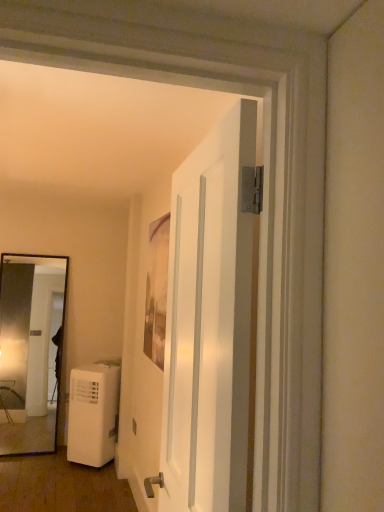
Question: Considering the relative sizes of white plastic air conditioner at lower left and white matte door at center in the image provided, is white plastic air conditioner at lower left shorter than white matte door at center?

Choices:
 (A) yes
 (B) no

Answer: (A)

Question: Is white plastic air conditioner at lower left behind white matte door at center?

Choices:
 (A) no
 (B) yes

Answer: (B)

Question: From the image's perspective, is white plastic air conditioner at lower left located beneath white matte door at center?

Choices:
 (A) no
 (B) yes

Answer: (B)

Question: Does white plastic air conditioner at lower left have a larger size compared to white matte door at center?

Choices:
 (A) no
 (B) yes

Answer: (B)

Question: Is white matte door at center completely or partially inside white plastic air conditioner at lower left?

Choices:
 (A) no
 (B) yes

Answer: (A)

Question: Considering the positions of white plastic air conditioner at lower left and white matte air purifier at lower left in the image, is white plastic air conditioner at lower left wider or thinner than white matte air purifier at lower left?

Choices:
 (A) wide
 (B) thin

Answer: (B)

Question: Based on their positions, is white plastic air conditioner at lower left located to the left or right of white matte air purifier at lower left?

Choices:
 (A) left
 (B) right

Answer: (B)

Question: In terms of height, does white plastic air conditioner at lower left look taller or shorter compared to white matte air purifier at lower left?

Choices:
 (A) short
 (B) tall

Answer: (B)

Question: From the image's perspective, is white plastic air conditioner at lower left above or below white matte air purifier at lower left?

Choices:
 (A) above
 (B) below

Answer: (A)

Question: From a real-world perspective, is white matte door at center above or below white plastic air conditioner at lower left?

Choices:
 (A) above
 (B) below

Answer: (A)

Question: Is white matte door at center in front of or behind white plastic air conditioner at lower left in the image?

Choices:
 (A) front
 (B) behind

Answer: (A)

Question: Is white matte door at center taller or shorter than white plastic air conditioner at lower left?

Choices:
 (A) short
 (B) tall

Answer: (B)

Question: Considering the relative positions of white matte door at center and white plastic air conditioner at lower left in the image provided, is white matte door at center to the left or to the right of white plastic air conditioner at lower left?

Choices:
 (A) right
 (B) left

Answer: (A)

Question: In the image, is white matte door at center positioned in front of or behind white matte air purifier at lower left?

Choices:
 (A) behind
 (B) front

Answer: (B)

Question: Based on their positions, is white matte door at center located to the left or right of white matte air purifier at lower left?

Choices:
 (A) right
 (B) left

Answer: (A)